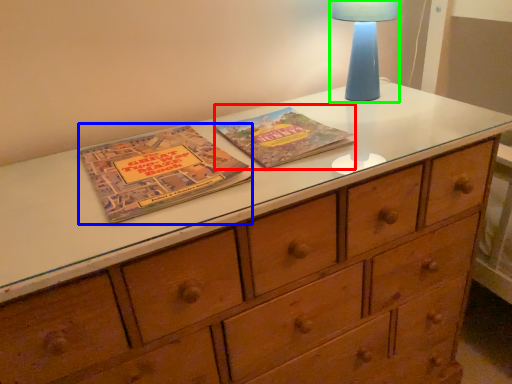
Question: Which object is the closest to the paperback book (highlighted by a red box)? Choose among these: paperback book (highlighted by a blue box) or bedside lamp (highlighted by a green box).

Choices:
 (A) paperback book
 (B) bedside lamp

Answer: (A)